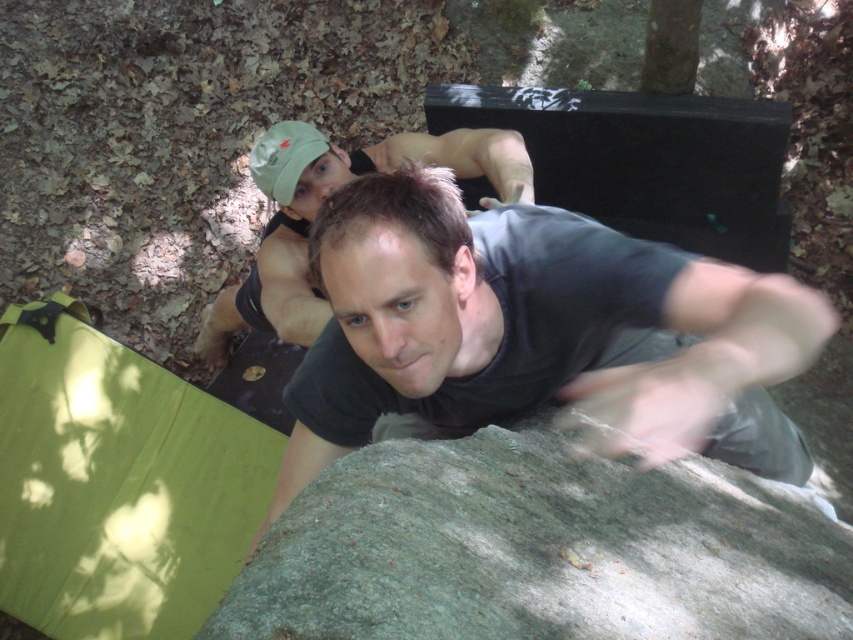
Is green rough rock at center thinner than matte black shirt at upper center?

Correct, green rough rock at center's width is less than matte black shirt at upper center's.

The image size is (853, 640). Find the location of `green rough rock at center`. green rough rock at center is located at coordinates (538, 548).

Identify the location of green rough rock at center. (538, 548).

Is dark gray t-shirt at center thinner than green rough rock at center?

In fact, dark gray t-shirt at center might be wider than green rough rock at center.

Can you confirm if dark gray t-shirt at center is positioned to the left of green rough rock at center?

No, dark gray t-shirt at center is not to the left of green rough rock at center.

At what (x,y) coordinates should I click in order to perform the action: click on dark gray t-shirt at center. Please return your answer as a coordinate pair (x, y). This screenshot has height=640, width=853. Looking at the image, I should click on (537, 333).

Does point (350, 300) come farther from viewer compared to point (502, 180)?

No.

Does dark gray t-shirt at center have a smaller size compared to matte black shirt at upper center?

Yes, dark gray t-shirt at center is smaller than matte black shirt at upper center.

Does point (525, 403) lie in front of point (254, 266)?

That is True.

What are the coordinates of `dark gray t-shirt at center` in the screenshot? It's located at (537, 333).